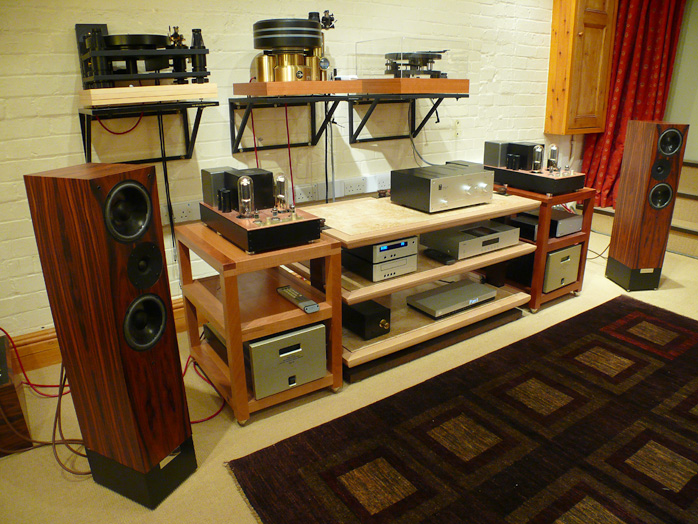
Where is `linoleum floor`? The width and height of the screenshot is (698, 524). linoleum floor is located at coordinates (280, 431).